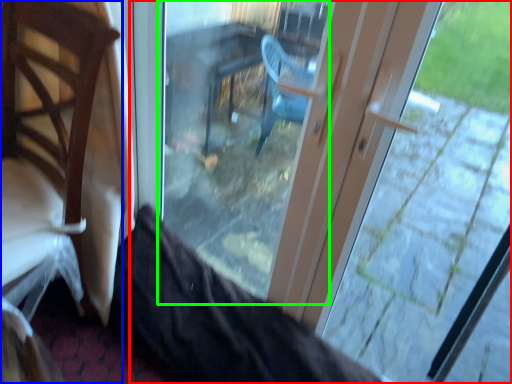
Question: Which is farther away from door (highlighted by a red box)? chair (highlighted by a blue box) or glass door (highlighted by a green box)?

Choices:
 (A) chair
 (B) glass door

Answer: (A)